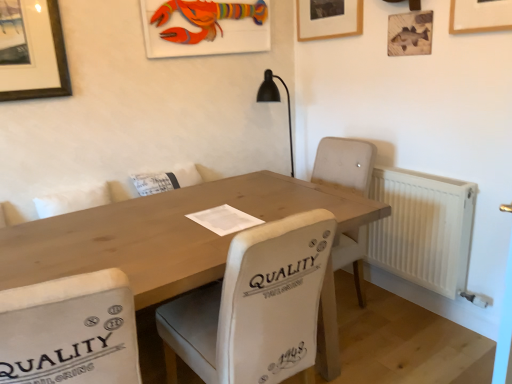
Question: From the image's perspective, is natural wood table at center positioned above or below wooden fish at upper right, which is the 3th picture frame in left-to-right order?

Choices:
 (A) below
 (B) above

Answer: (A)

Question: Considering the relative positions of natural wood table at center and wooden fish at upper right, the 1th picture frame positioned from the right, in the image provided, is natural wood table at center to the left or to the right of wooden fish at upper right, the 1th picture frame positioned from the right,?

Choices:
 (A) left
 (B) right

Answer: (A)

Question: Which object is the closest to the natural wood table at center?

Choices:
 (A) white fabric chair at lower left, the 2th chair positioned from the right
 (B) white plastic radiator at right
 (C) white fabric chair at center, which is the first chair in right-to-left order
 (D) wooden fish at upper right, the 1th picture frame positioned from the right
 (E) wooden lobster at upper center, which ranks as the 3th picture frame in right-to-left order

Answer: (C)

Question: Which object is positioned farthest from the white fabric chair at lower left, which is the first chair from left to right?

Choices:
 (A) natural wood table at center
 (B) white fabric chair at center, which is the first chair in right-to-left order
 (C) wooden picture frame at upper center, which ranks as the second picture frame in right-to-left order
 (D) wooden lobster at upper center, which ranks as the 3th picture frame in right-to-left order
 (E) white plastic radiator at right

Answer: (C)